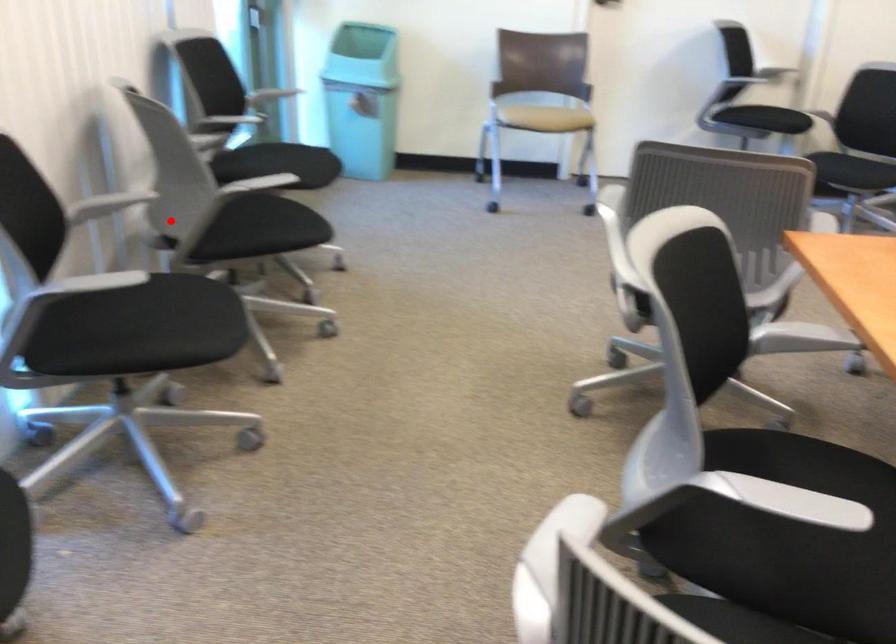
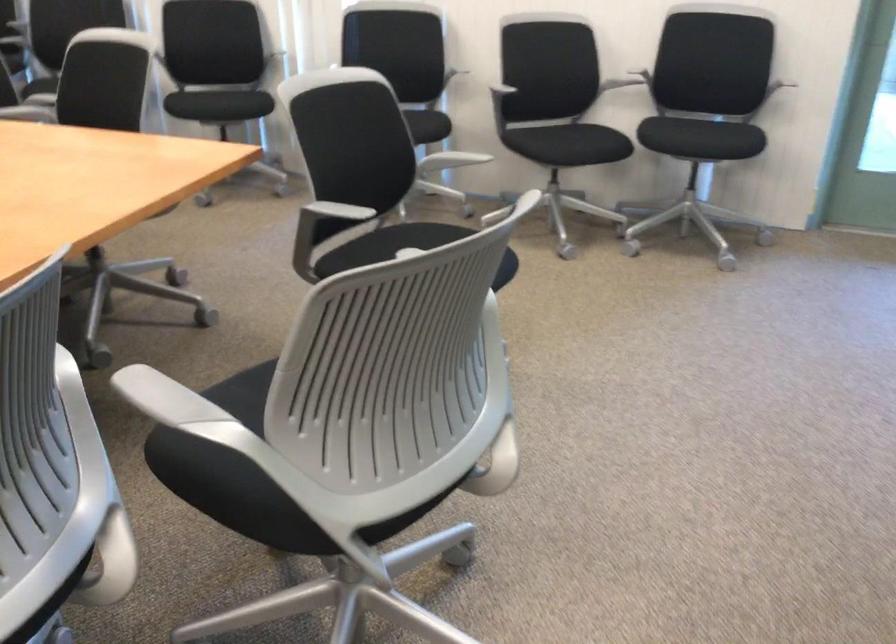
The point at the highlighted location is marked in the first image. Where is the corresponding point in the second image?

(510, 96)